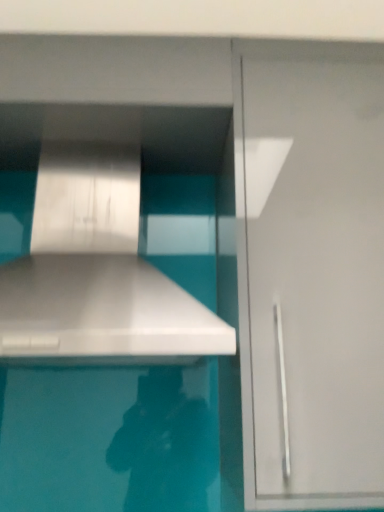
The width and height of the screenshot is (384, 512). What are the coordinates of `vacant region above white glossy vent at center (from a real-world perspective)` in the screenshot? It's located at (89, 125).